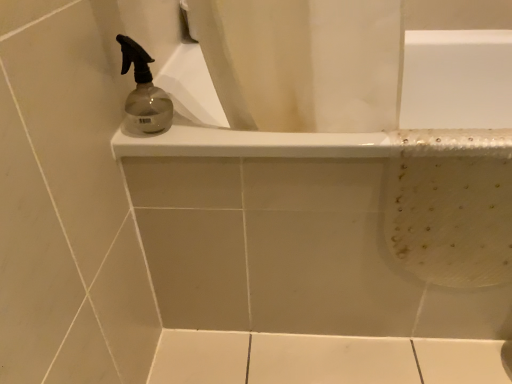
Question: Which is correct: transparent glass spray bottle at upper left is inside white glossy bathtub at upper center, or outside of it?

Choices:
 (A) inside
 (B) outside

Answer: (B)

Question: From a real-world perspective, is transparent glass spray bottle at upper left physically located above or below white glossy bathtub at upper center?

Choices:
 (A) below
 (B) above

Answer: (B)

Question: Is point (167, 100) positioned closer to the camera than point (321, 185)?

Choices:
 (A) farther
 (B) closer

Answer: (A)

Question: Is white glossy bathtub at upper center bigger or smaller than transparent glass spray bottle at upper left?

Choices:
 (A) big
 (B) small

Answer: (A)

Question: Is white glossy bathtub at upper center taller or shorter than transparent glass spray bottle at upper left?

Choices:
 (A) tall
 (B) short

Answer: (A)

Question: Is white glossy bathtub at upper center in front of or behind transparent glass spray bottle at upper left in the image?

Choices:
 (A) behind
 (B) front

Answer: (A)

Question: Is white glossy bathtub at upper center wider or thinner than transparent glass spray bottle at upper left?

Choices:
 (A) wide
 (B) thin

Answer: (A)